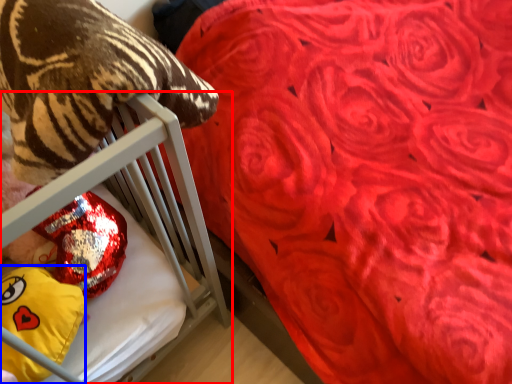
Question: Which of the following is the closest to the observer, furniture (highlighted by a red box) or throw pillow (highlighted by a blue box)?

Choices:
 (A) furniture
 (B) throw pillow

Answer: (B)